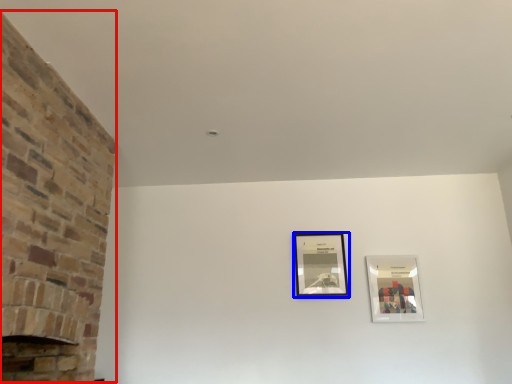
Question: Which object appears farthest to the camera in this image, fireplace (highlighted by a red box) or picture frame (highlighted by a blue box)?

Choices:
 (A) fireplace
 (B) picture frame

Answer: (B)